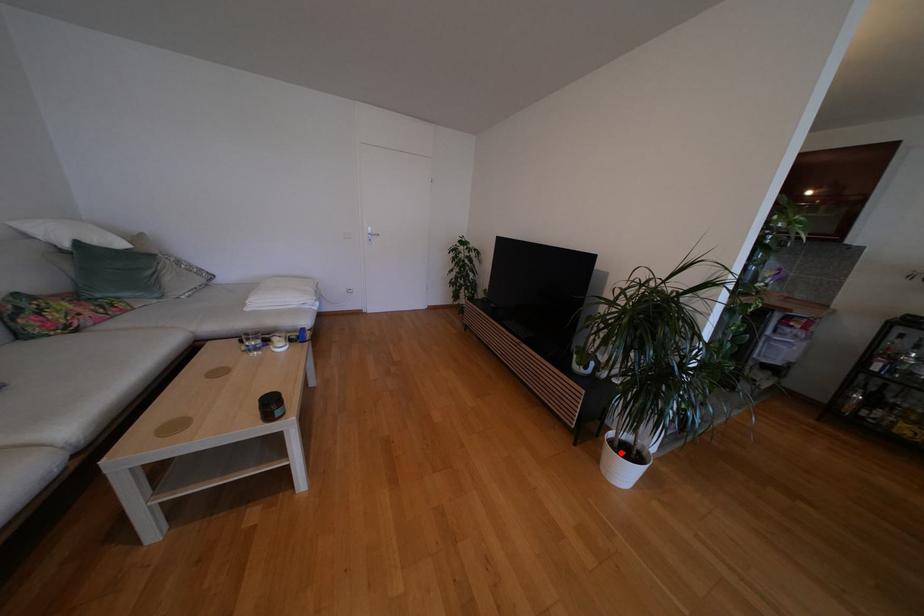
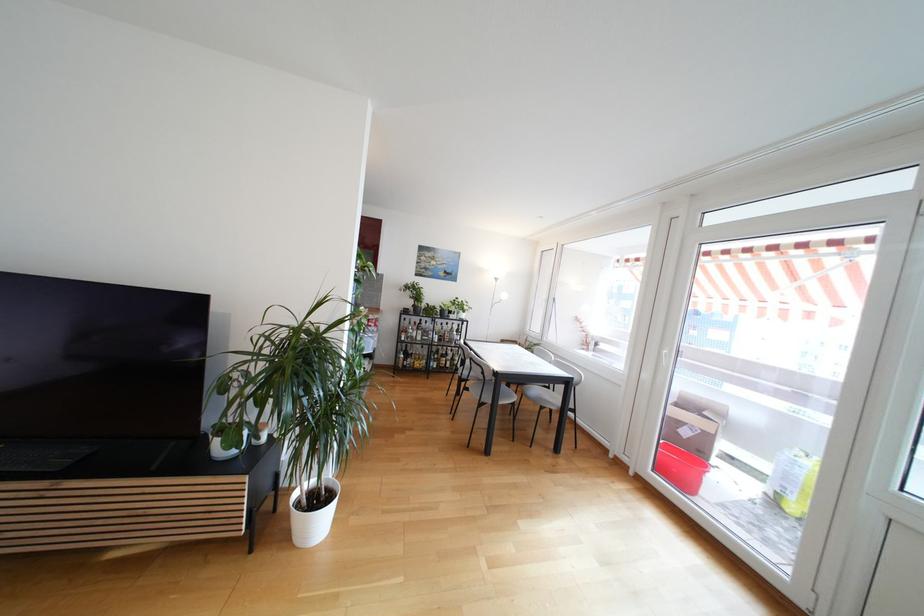
Where in the second image is the point corresponding to the highlighted location from the first image?

(310, 511)